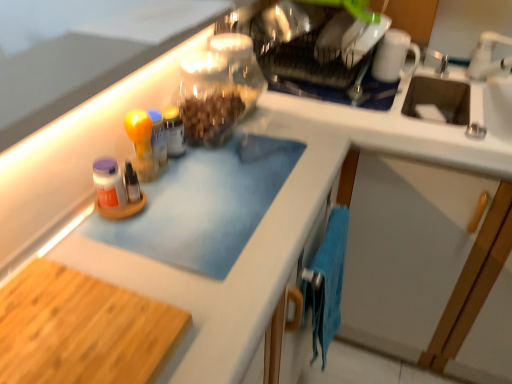
Image resolution: width=512 pixels, height=384 pixels. What are the coordinates of `free space above blue matte cutting board at upper left (from a real-world perspective)` in the screenshot? It's located at (98, 43).